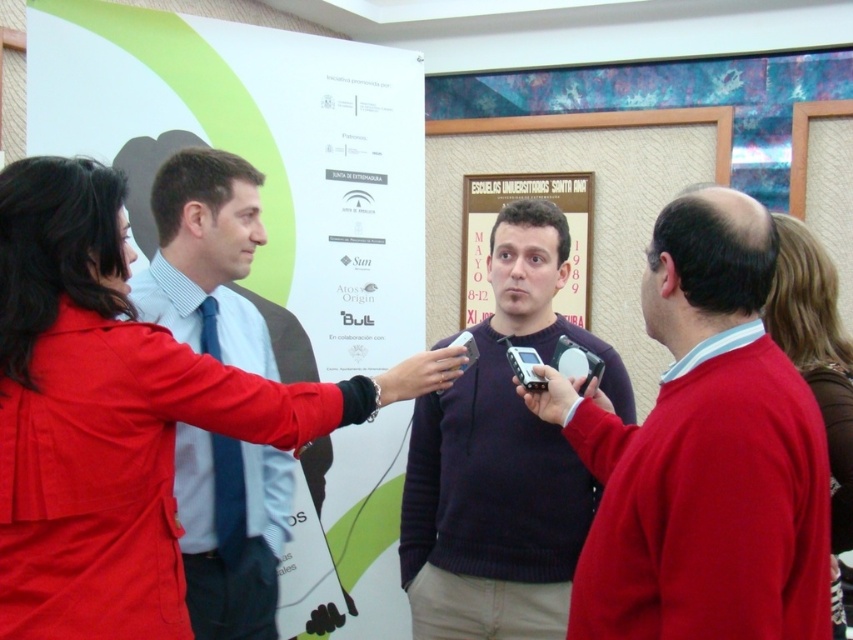
You are a photographer at the event and need to position yourself so that the white paper poster at center and the dark purple sweater at center are both in your frame. Based on their positions, which object should be placed on the left side of your camera frame?

The white paper poster at center should be placed on the left side of your camera frame because it is positioned to the left of the dark purple sweater at center.

You are a photographer at the event and need to capture a clear shot of both the white paper poster at center and the dark purple sweater at center. Can you position yourself so that both are visible in the frame without any obstruction?

Yes, the white paper poster at center is above the dark purple sweater at center, so positioning the camera to include both the upper and lower areas would allow both to be visible without obstruction.